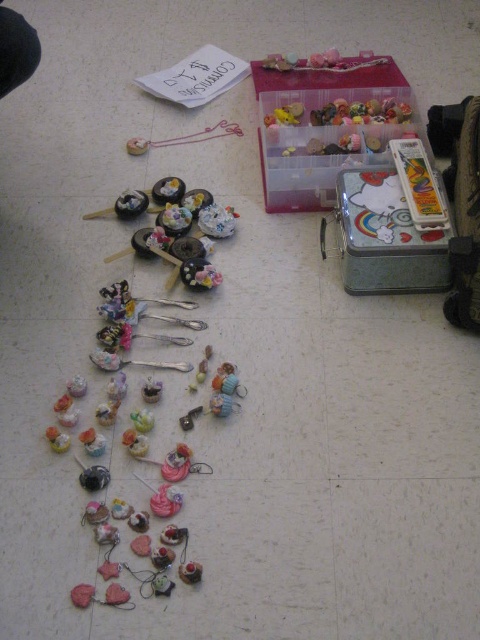
From the picture: Where is the pink glossy cupcake at lower left located in the image?

The pink glossy cupcake at lower left is located at point (57, 440) in the image.

Looking at this image, you are organizing the miniature items and need to place the matte plastic cupcakes at upper center and the pink glossy cupcake at lower left into their respective storage containers. Based on their positions in the image, which cupcake should be placed first if you want to maintain the vertical arrangement seen in the scene?

The matte plastic cupcakes at upper center should be placed first since they are positioned above the pink glossy cupcake at lower left in the scene, so placing them first would allow the lower one to be placed afterward to maintain the vertical arrangement.